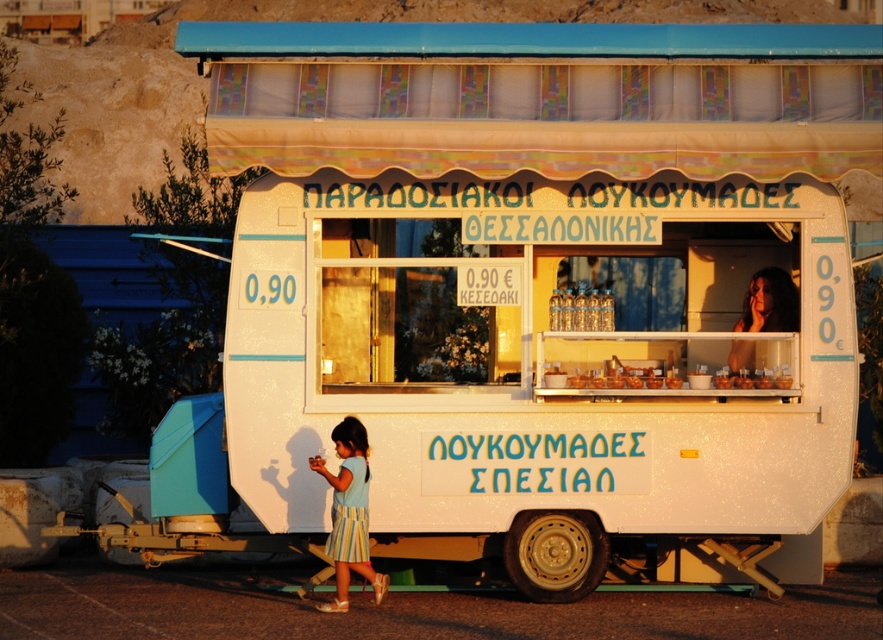
Can you confirm if smooth brown hair at upper right is smaller than translucent glass jars at center?

Incorrect, smooth brown hair at upper right is not smaller in size than translucent glass jars at center.

Does point (774, 305) come farther from viewer compared to point (625, 372)?

Yes, it is.

Find the location of `smooth brown hair at upper right`. smooth brown hair at upper right is located at coordinates (768, 301).

Which of these two, light blue fabric dress at lower center or translucent glass jars at center, stands shorter?

translucent glass jars at center

Which is more to the left, light blue fabric dress at lower center or translucent glass jars at center?

light blue fabric dress at lower center

Describe the element at coordinates (349, 513) in the screenshot. The image size is (883, 640). I see `light blue fabric dress at lower center` at that location.

Identify the location of light blue fabric dress at lower center. (349, 513).

Does light blue fabric dress at lower center appear under smooth brown hair at upper right?

Yes, light blue fabric dress at lower center is below smooth brown hair at upper right.

Is point (338, 432) closer to viewer compared to point (738, 353)?

Yes, point (338, 432) is in front of point (738, 353).

Where is `light blue fabric dress at lower center`? light blue fabric dress at lower center is located at coordinates (349, 513).